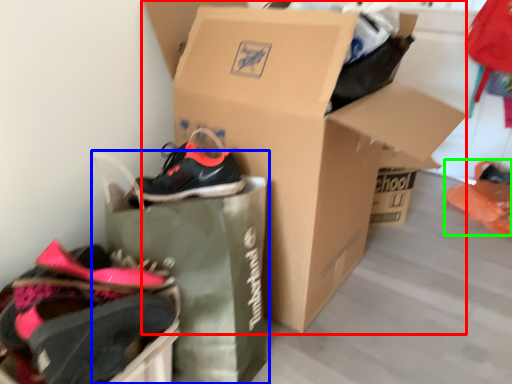
Question: Based on their relative distances, which object is nearer to box (highlighted by a red box)? Choose from shopping bag (highlighted by a blue box) and footwear (highlighted by a green box).

Choices:
 (A) shopping bag
 (B) footwear

Answer: (A)